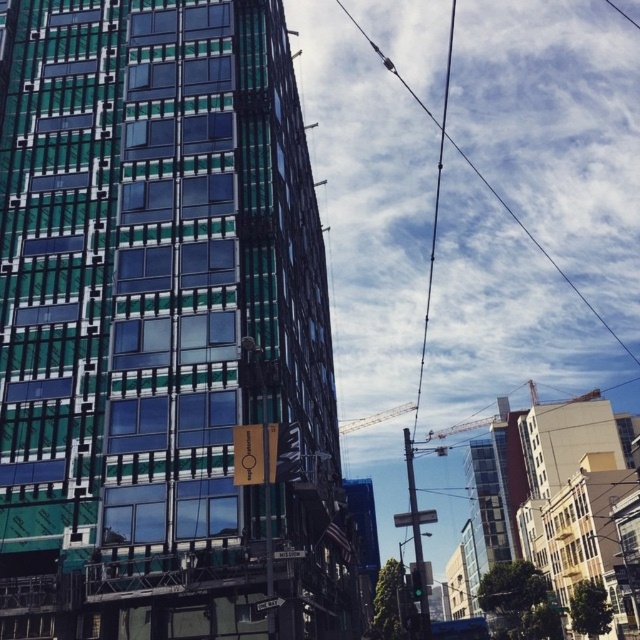
Is metallic rectangular at center below metallic one way sign at lower center?

Correct, metallic rectangular at center is located below metallic one way sign at lower center.

Is point (428, 513) behind point (276, 604)?

Yes, it is behind point (276, 604).

This screenshot has height=640, width=640. Find the location of `metallic rectangular at center`. metallic rectangular at center is located at coordinates [413, 516].

Between green glass building at center and metallic one way sign at lower center, which one appears on the right side from the viewer's perspective?

metallic one way sign at lower center

Is green glass building at center to the left of metallic one way sign at lower center from the viewer's perspective?

Indeed, green glass building at center is positioned on the left side of metallic one way sign at lower center.

Between point (42, 385) and point (259, 605), which one is positioned behind?

The point (42, 385) is behind.

I want to click on green glass building at center, so click(160, 324).

Is clear wire at upper right in front of metallic rectangular at center?

That is False.

Find the location of a particular element. Image resolution: width=640 pixels, height=640 pixels. clear wire at upper right is located at coordinates (541, 250).